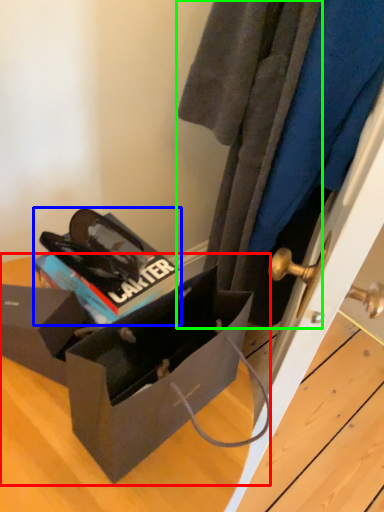
Question: Estimate the real-world distances between objects in this image. Which object is farther from box (highlighted by a red box), kit (highlighted by a blue box) or clothing (highlighted by a green box)?

Choices:
 (A) kit
 (B) clothing

Answer: (B)